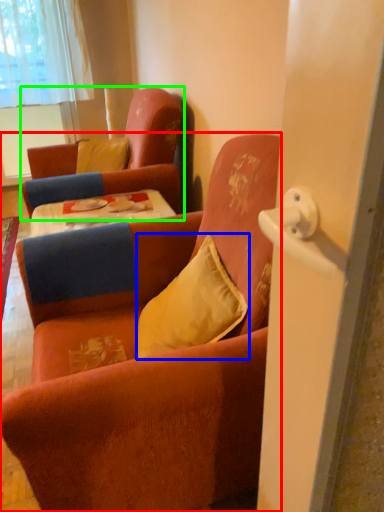
Question: Which object is the farthest from chair (highlighted by a red box)? Choose among these: pillow (highlighted by a blue box) or chair (highlighted by a green box).

Choices:
 (A) pillow
 (B) chair

Answer: (B)